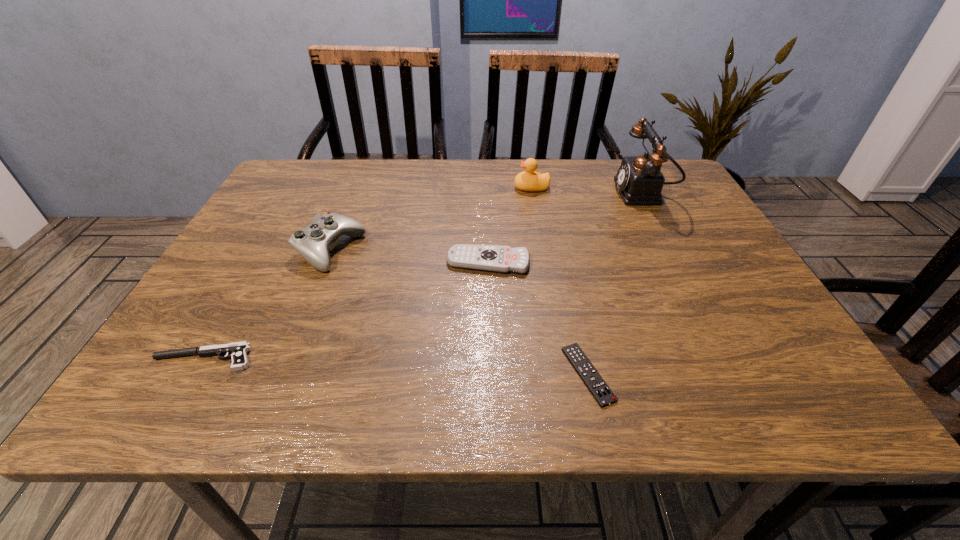
The height and width of the screenshot is (540, 960). In order to click on telephone in this screenshot , I will do `click(640, 181)`.

This screenshot has width=960, height=540. What are the coordinates of `the rightmost object` in the screenshot? It's located at (640, 181).

Locate an element on the screen. the fifth shortest object is located at coordinates (529, 180).

The width and height of the screenshot is (960, 540). I want to click on the fourth shortest object, so click(x=313, y=243).

Where is `the left remote control`? Image resolution: width=960 pixels, height=540 pixels. the left remote control is located at coordinates (503, 259).

The width and height of the screenshot is (960, 540). I want to click on the farther remote control, so click(x=503, y=259).

Image resolution: width=960 pixels, height=540 pixels. What are the coordinates of `the fifth tallest object` in the screenshot? It's located at (237, 351).

Locate an element on the screen. This screenshot has width=960, height=540. the nearer remote control is located at coordinates (594, 382).

Find the location of a particular element. the shorter remote control is located at coordinates (594, 382).

Find the location of a particular element. This screenshot has height=540, width=960. free region located 0.080m on the front of the telephone at the rotary dial is located at coordinates (587, 193).